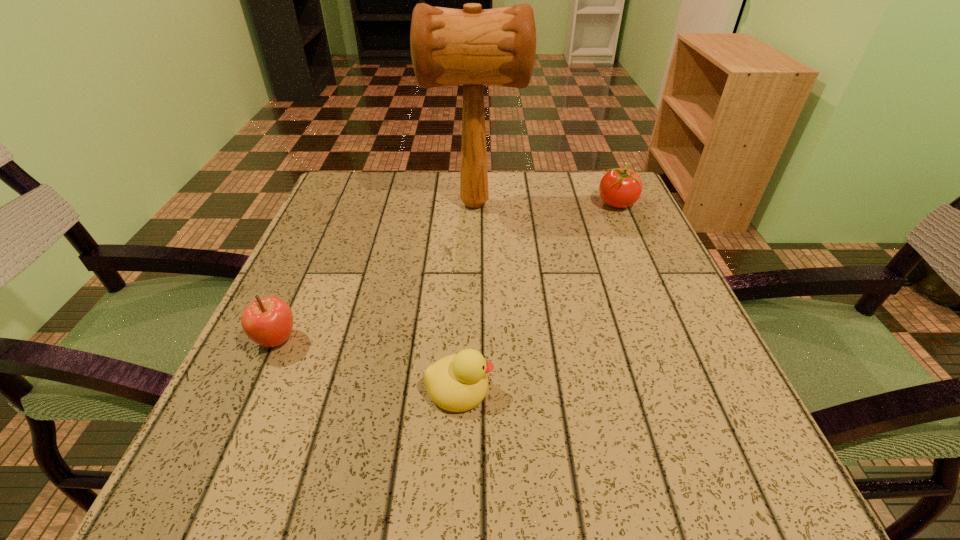
Locate an element on the screen. Image resolution: width=960 pixels, height=540 pixels. unoccupied position between the tomato and the third farthest object is located at coordinates (446, 272).

Locate an element on the screen. vacant region between the tomato and the shortest object is located at coordinates (538, 295).

Select which object is the second closest to the tomato. Please provide its 2D coordinates. Your answer should be formatted as a tuple, i.e. [(x, y)], where the tuple contains the x and y coordinates of a point satisfying the conditions above.

[(458, 382)]

The height and width of the screenshot is (540, 960). Identify the location of object identified as the closest to the nearest object. (268, 322).

Where is `vacant space that satisfies the following two spatial constraints: 1. on the back side of the apple; 2. on the left side of the tomato`? The height and width of the screenshot is (540, 960). vacant space that satisfies the following two spatial constraints: 1. on the back side of the apple; 2. on the left side of the tomato is located at coordinates (339, 204).